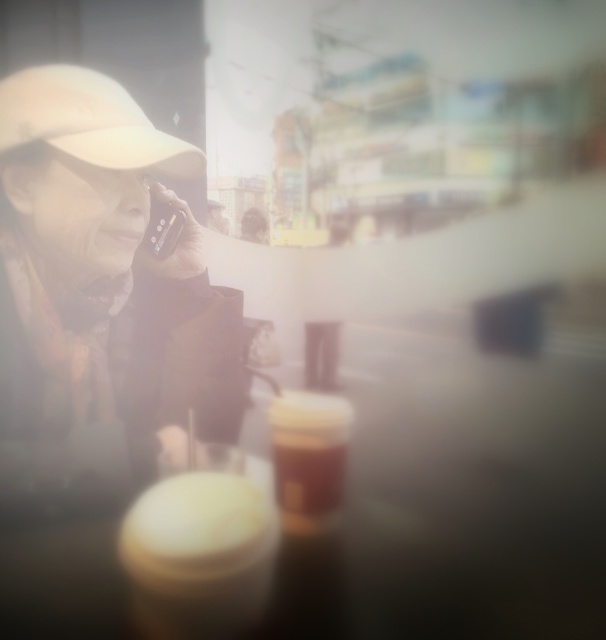
Question: Which of the following is the farthest from the observer?

Choices:
 (A) (108, 115)
 (B) (187, 173)
 (C) (303, 403)

Answer: (B)

Question: Does matte beige cap at left come behind translucent plastic cup at lower center?

Choices:
 (A) no
 (B) yes

Answer: (B)

Question: Which point is closer to the camera taking this photo?

Choices:
 (A) tap(92, 161)
 (B) tap(347, 401)
 (C) tap(161, 259)

Answer: (A)

Question: Does translucent plastic cup at lower center have a larger size compared to matte black phone at upper left?

Choices:
 (A) yes
 (B) no

Answer: (A)

Question: Which point is closer to the camera?

Choices:
 (A) matte black phone at upper left
 (B) translucent plastic cup at lower center
 (C) matte beige cap at left

Answer: (B)

Question: Observing the image, what is the correct spatial positioning of matte beige cap at left in reference to beige fabric baseball hat at upper left?

Choices:
 (A) above
 (B) below

Answer: (B)